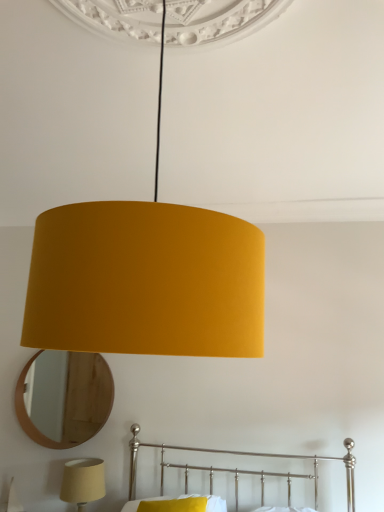
Question: Which is correct: matte yellow fabric lampshade at center, marked as the first lamp in a right-to-left arrangement, is inside matte yellow lampshade at lower left, which is the second lamp in top-to-bottom order, or outside of it?

Choices:
 (A) inside
 (B) outside

Answer: (B)

Question: From a real-world perspective, is matte yellow fabric lampshade at center, marked as the first lamp in a right-to-left arrangement, positioned above or below matte yellow lampshade at lower left, which is the second lamp in top-to-bottom order?

Choices:
 (A) below
 (B) above

Answer: (B)

Question: Which object is the closest to the wooden mirror at lower left?

Choices:
 (A) metallic silver bed at lower center
 (B) yellow fabric pillow at lower center
 (C) matte yellow fabric lampshade at center, marked as the first lamp in a front-to-back arrangement
 (D) matte yellow lampshade at lower left, which is the second lamp in top-to-bottom order

Answer: (D)

Question: Which of these objects is positioned closest to the wooden mirror at lower left?

Choices:
 (A) metallic silver bed at lower center
 (B) matte yellow lampshade at lower left, which is the first lamp in bottom-to-top order
 (C) matte yellow fabric lampshade at center, the second lamp when ordered from bottom to top
 (D) yellow fabric pillow at lower center

Answer: (B)